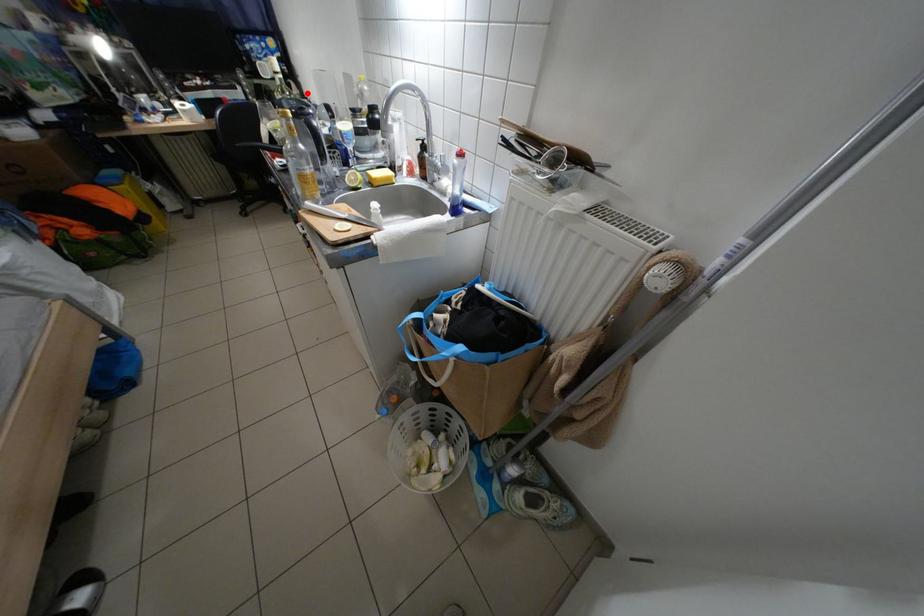
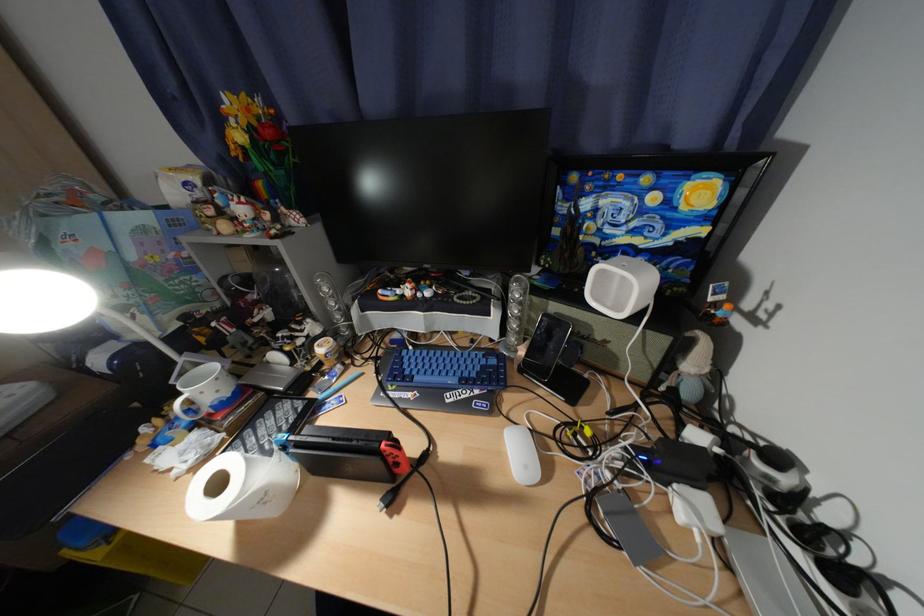
The point at the highlighted location is marked in the first image. Where is the corresponding point in the second image?

(704, 367)